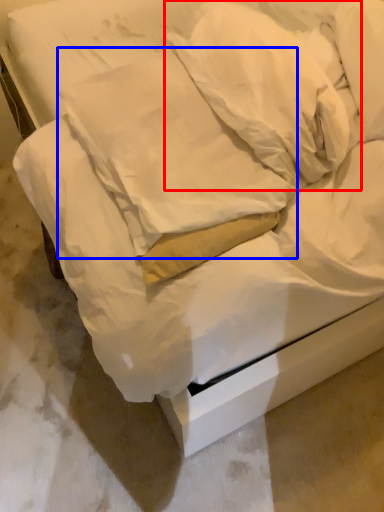
Question: Which point is closer to the camera, pillow (highlighted by a red box) or pillow (highlighted by a blue box)?

Choices:
 (A) pillow
 (B) pillow

Answer: (B)